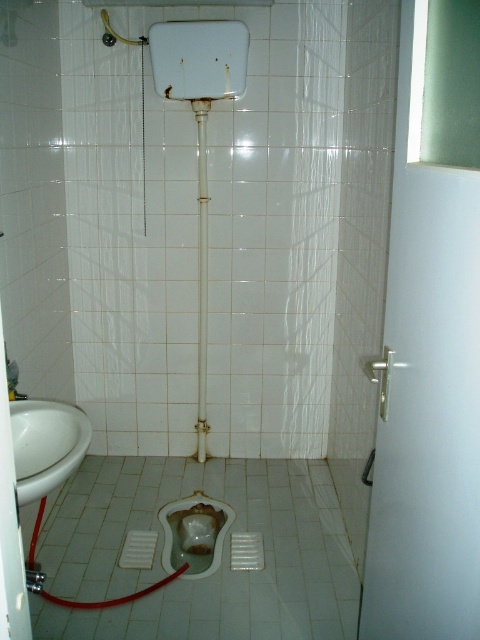
In the bathroom scene described, which object is positioned to the right of the other between the metallic pipe at center and the metallic silver shower head at upper left?

The metallic pipe at center is to the right of the metallic silver shower head at upper left.

You are a plumber inspecting the bathroom. You notice the matte white toilet bowl at center and the metallic pipe at center. Which object is positioned lower in the image?

The matte white toilet bowl at center is below the metallic pipe at center, so it is positioned lower in the image.